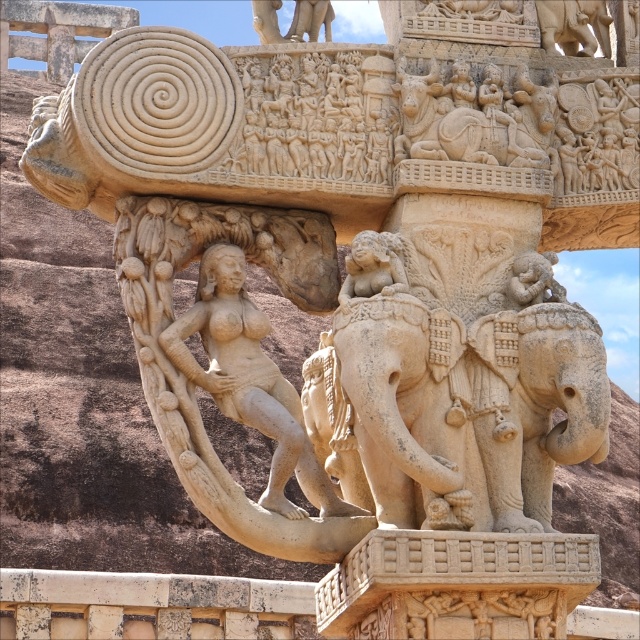
You are an art conservator examining the stone structure. You notice the carved stone elephant at center and the beige stone statue at center. Which object is positioned closer to the front of the structure?

The carved stone elephant at center is closer to the viewer than the beige stone statue at center, so it is positioned closer to the front of the structure.

Looking at this image, you are standing in front of the beige stone elephant at center. Where exactly is it located in the image?

The beige stone elephant at center is located at point [403,408].